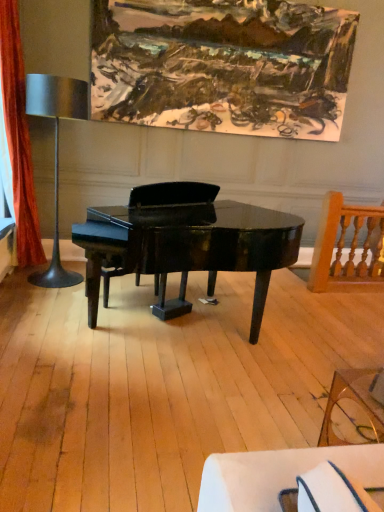
Question: Is oil paint canvas at upper center oriented away from transparent glass coffee table at lower right?

Choices:
 (A) yes
 (B) no

Answer: (B)

Question: From the image's perspective, is oil paint canvas at upper center on transparent glass coffee table at lower right?

Choices:
 (A) yes
 (B) no

Answer: (A)

Question: Could transparent glass coffee table at lower right be considered to be inside oil paint canvas at upper center?

Choices:
 (A) no
 (B) yes

Answer: (A)

Question: Is the position of oil paint canvas at upper center more distant than that of transparent glass coffee table at lower right?

Choices:
 (A) no
 (B) yes

Answer: (B)

Question: Does oil paint canvas at upper center have a smaller size compared to transparent glass coffee table at lower right?

Choices:
 (A) yes
 (B) no

Answer: (B)

Question: Is transparent glass coffee table at lower right spatially inside wooden spindle chair at right, or outside of it?

Choices:
 (A) inside
 (B) outside

Answer: (B)

Question: From a real-world perspective, is transparent glass coffee table at lower right above or below wooden spindle chair at right?

Choices:
 (A) below
 (B) above

Answer: (A)

Question: In terms of size, does transparent glass coffee table at lower right appear bigger or smaller than wooden spindle chair at right?

Choices:
 (A) small
 (B) big

Answer: (A)

Question: Considering the positions of point (360, 393) and point (321, 244), is point (360, 393) closer or farther from the camera than point (321, 244)?

Choices:
 (A) closer
 (B) farther

Answer: (A)

Question: Considering the positions of glossy black piano at center and wooden spindle chair at right in the image, is glossy black piano at center wider or thinner than wooden spindle chair at right?

Choices:
 (A) thin
 (B) wide

Answer: (B)

Question: From the image's perspective, is glossy black piano at center above or below wooden spindle chair at right?

Choices:
 (A) below
 (B) above

Answer: (A)

Question: Visually, is glossy black piano at center positioned to the left or to the right of wooden spindle chair at right?

Choices:
 (A) right
 (B) left

Answer: (B)

Question: Is glossy black piano at center inside or outside of wooden spindle chair at right?

Choices:
 (A) outside
 (B) inside

Answer: (A)

Question: From a real-world perspective, is orange velvet curtain at left positioned above or below transparent glass coffee table at lower right?

Choices:
 (A) above
 (B) below

Answer: (A)

Question: Considering the positions of point (36, 260) and point (322, 421), is point (36, 260) closer or farther from the camera than point (322, 421)?

Choices:
 (A) farther
 (B) closer

Answer: (A)